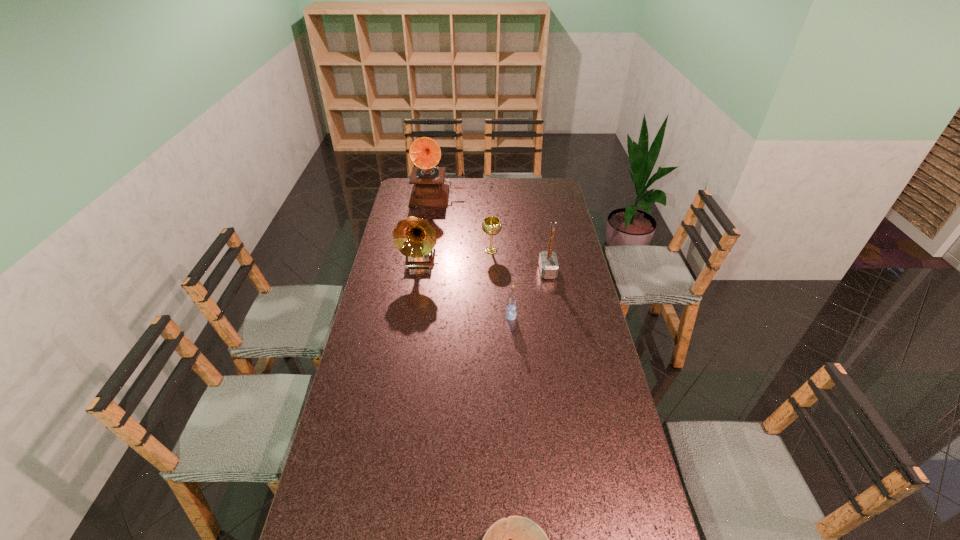
The width and height of the screenshot is (960, 540). What are the coordinates of `the farther phonograph_record` in the screenshot? It's located at (429, 190).

At what (x,y) coordinates should I click in order to perform the action: click on the tallest object. Please return your answer as a coordinate pair (x, y). The image size is (960, 540). Looking at the image, I should click on (429, 190).

Image resolution: width=960 pixels, height=540 pixels. I want to click on the nearer phonograph_record, so click(415, 238).

Locate an element on the screen. the rightmost object is located at coordinates (548, 263).

Locate an element on the screen. chalice is located at coordinates (491, 225).

Identify the location of the fifth farthest object. (511, 313).

Locate an element on the screen. The width and height of the screenshot is (960, 540). blank space located 0.080m on the horn of the farthest object is located at coordinates (435, 215).

Identify the location of blank space located on the horn of the shorter phonograph_record. The width and height of the screenshot is (960, 540). (407, 340).

The height and width of the screenshot is (540, 960). I want to click on free space located on the striking surface of the rightmost object, so click(x=499, y=272).

Where is `vacant space situated on the striking surface of the rightmost object`? vacant space situated on the striking surface of the rightmost object is located at coordinates (456, 272).